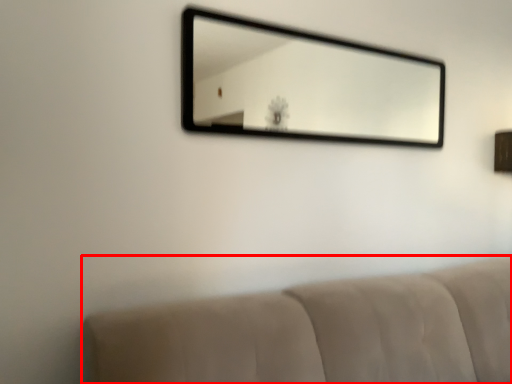
Question: From the image's perspective, where is furniture (annotated by the red box) located relative to mirror?

Choices:
 (A) above
 (B) below

Answer: (B)